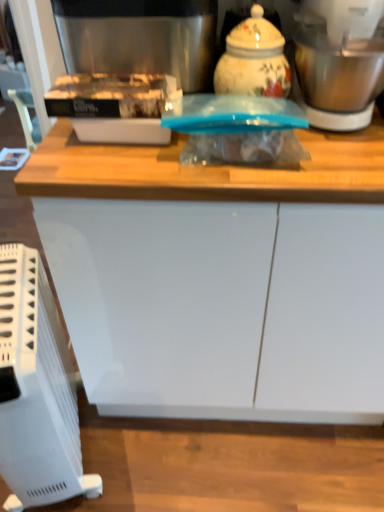
Locate an element on the screen. vacant area that is in front of matte plastic container at upper left is located at coordinates 107,165.